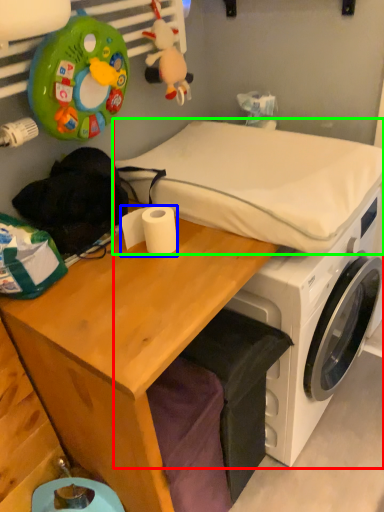
Question: Based on their relative distances, which object is farther from machine (highlighted by a red box)? Choose from toilet paper (highlighted by a blue box) and mattress (highlighted by a green box).

Choices:
 (A) toilet paper
 (B) mattress

Answer: (A)